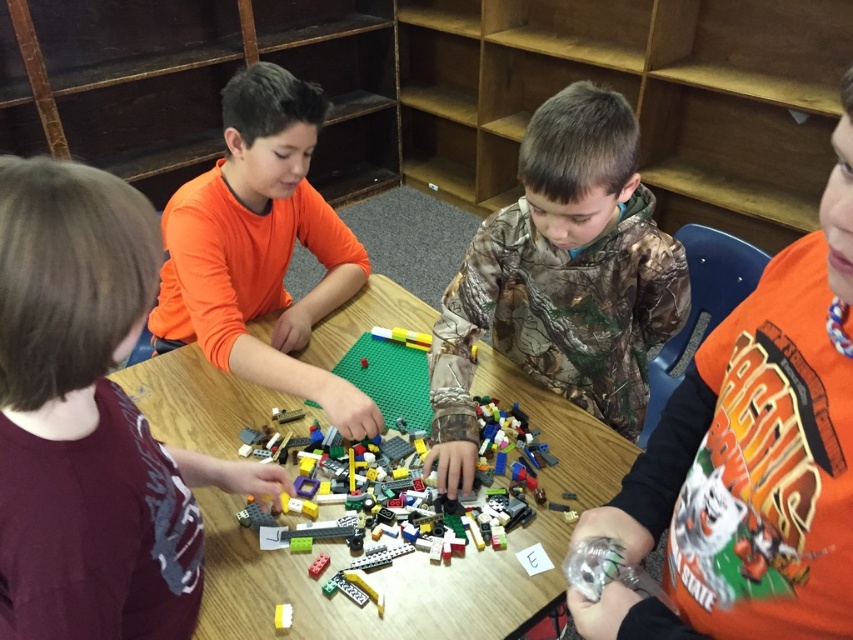
Between maroon cotton shirt at left and multicolored plastic lego pieces at center, which one has less height?

Standing shorter between the two is multicolored plastic lego pieces at center.

You are a GUI agent. You are given a task and a screenshot of the screen. Output one action in this format:
    pyautogui.click(x=<x>, y=<y>)
    Task: Click on the maroon cotton shirt at left
    The height and width of the screenshot is (640, 853).
    Given the screenshot: What is the action you would take?
    point(88,420)

At what (x,y) coordinates should I click in order to perform the action: click on maroon cotton shirt at left. Please return your answer as a coordinate pair (x, y). Looking at the image, I should click on (88, 420).

Who is positioned more to the left, maroon cotton shirt at left or wooden table at center?

maroon cotton shirt at left

Is maroon cotton shirt at left above wooden table at center?

Yes.

Is point (67, 602) farther from viewer compared to point (245, 604)?

No.

Locate an element on the screen. Image resolution: width=853 pixels, height=640 pixels. maroon cotton shirt at left is located at coordinates (88, 420).

Is maroon cotton shirt at left above orange cotton shirt at right?

No, maroon cotton shirt at left is not above orange cotton shirt at right.

In the scene shown: Is the position of maroon cotton shirt at left less distant than that of orange cotton shirt at right?

No, maroon cotton shirt at left is behind orange cotton shirt at right.

Describe the element at coordinates (88, 420) in the screenshot. This screenshot has height=640, width=853. I see `maroon cotton shirt at left` at that location.

Locate an element on the screen. Image resolution: width=853 pixels, height=640 pixels. maroon cotton shirt at left is located at coordinates (88, 420).